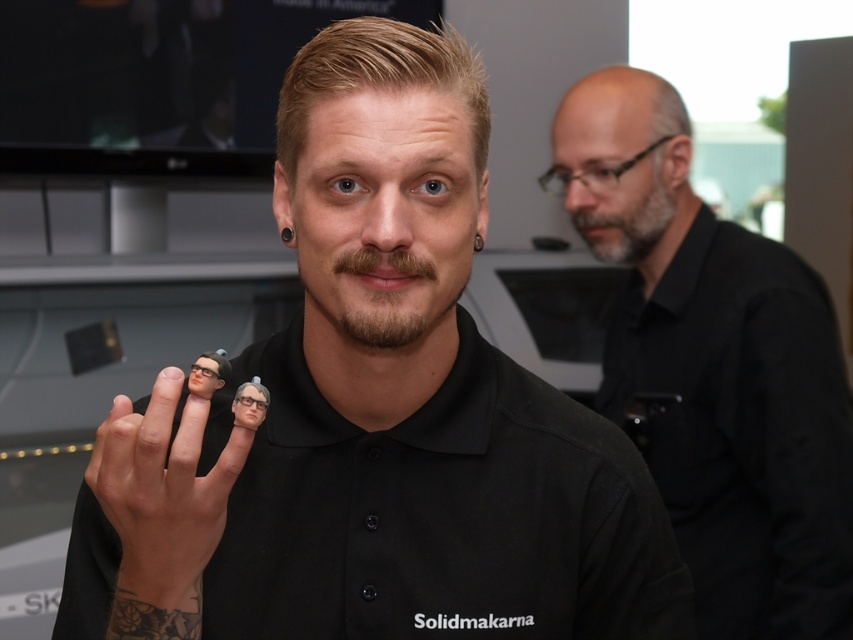
Does black matte shirt at upper right appear under brown matte beard at center?

Yes.

What do you see at coordinates (715, 369) in the screenshot?
I see `black matte shirt at upper right` at bounding box center [715, 369].

Identify the location of black matte shirt at upper right. The image size is (853, 640). (715, 369).

Can you confirm if black matte finger puppet at center is positioned below gray/bearded man at upper right?

Yes, black matte finger puppet at center is below gray/bearded man at upper right.

Based on the photo, who is higher up, black matte finger puppet at center or gray/bearded man at upper right?

gray/bearded man at upper right

Is point (648, 570) positioned before point (666, 205)?

Yes, it is.

Where is `black matte finger puppet at center`? The image size is (853, 640). black matte finger puppet at center is located at coordinates tap(373, 417).

The image size is (853, 640). Describe the element at coordinates (163, 492) in the screenshot. I see `matte black finger at center` at that location.

Which is below, matte black finger at center or gray/bearded man at upper right?

matte black finger at center

Between point (186, 584) and point (618, 236), which one is positioned behind?

Point (618, 236)

Where is `matte black finger at center`? This screenshot has width=853, height=640. matte black finger at center is located at coordinates (163, 492).